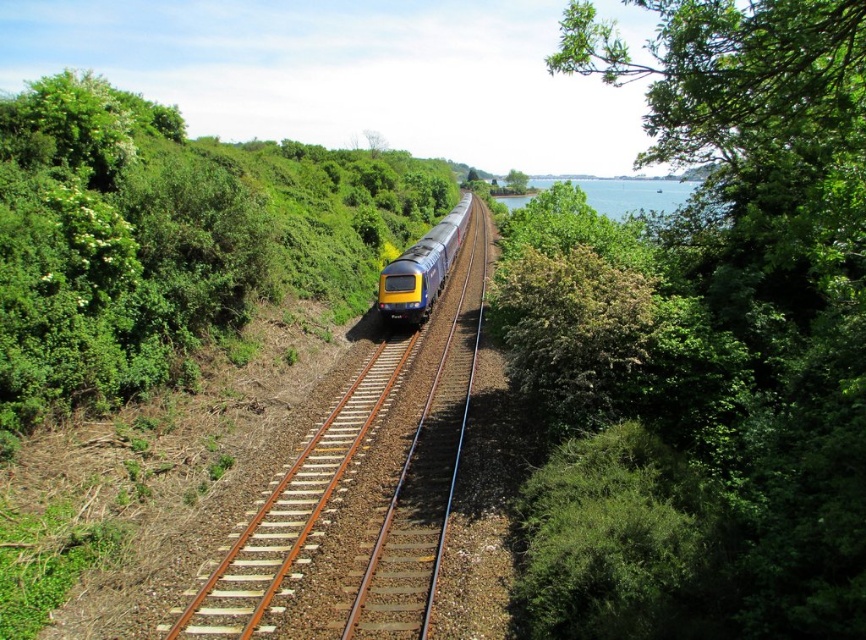
Consider the image. Which of these two, green leafy tree at right or blue metallic train at center, stands shorter?

blue metallic train at center is shorter.

Looking at this image, which is more to the right, green leafy tree at right or blue metallic train at center?

From the viewer's perspective, green leafy tree at right appears more on the right side.

Locate an element on the screen. green leafy tree at right is located at coordinates (703, 340).

Who is more distant from viewer, (320, 436) or (670, 216)?

The point (670, 216) is more distant.

Can you confirm if yellowmetallictrain at center is positioned below blue water at upper center?

Yes, yellowmetallictrain at center is below blue water at upper center.

Locate an element on the screen. yellowmetallictrain at center is located at coordinates (292, 509).

Where is `yellowmetallictrain at center`? yellowmetallictrain at center is located at coordinates (292, 509).

How far apart are blue water at upper center and blue metallic train at center?

blue water at upper center is 164.76 feet from blue metallic train at center.

Is blue water at upper center taller than blue metallic train at center?

Yes.

Locate an element on the screen. Image resolution: width=866 pixels, height=640 pixels. blue water at upper center is located at coordinates (638, 198).